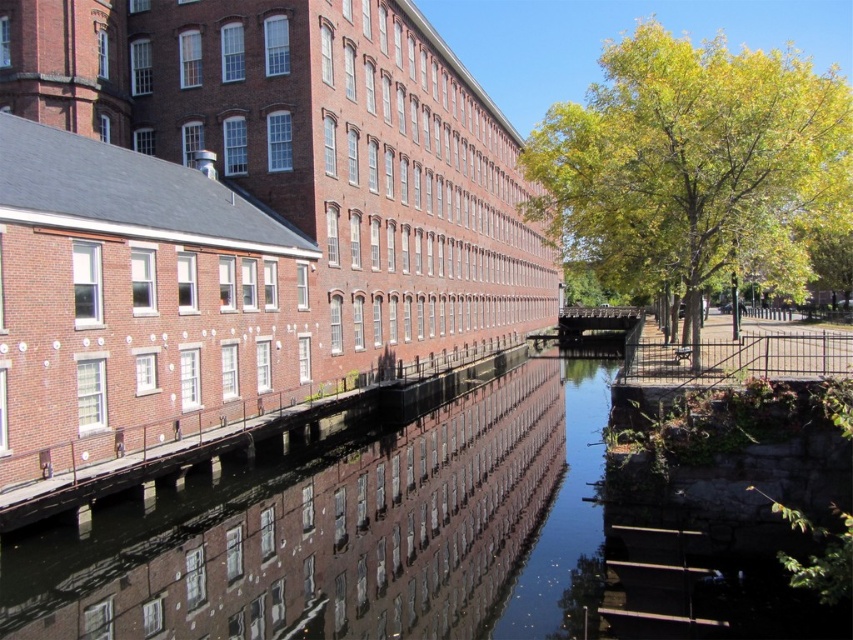
Question: Can you confirm if smooth concrete river at center is positioned below green leafy tree at right?

Choices:
 (A) yes
 (B) no

Answer: (A)

Question: Which object appears farthest from the camera in this image?

Choices:
 (A) green leafy tree at right
 (B) smooth concrete river at center

Answer: (A)

Question: Can you confirm if smooth concrete river at center is positioned below green leafy tree at right?

Choices:
 (A) yes
 (B) no

Answer: (A)

Question: Which point is closer to the camera taking this photo?

Choices:
 (A) (675, 100)
 (B) (393, 544)

Answer: (B)

Question: Is smooth concrete river at center further to camera compared to green leafy tree at right?

Choices:
 (A) yes
 (B) no

Answer: (B)